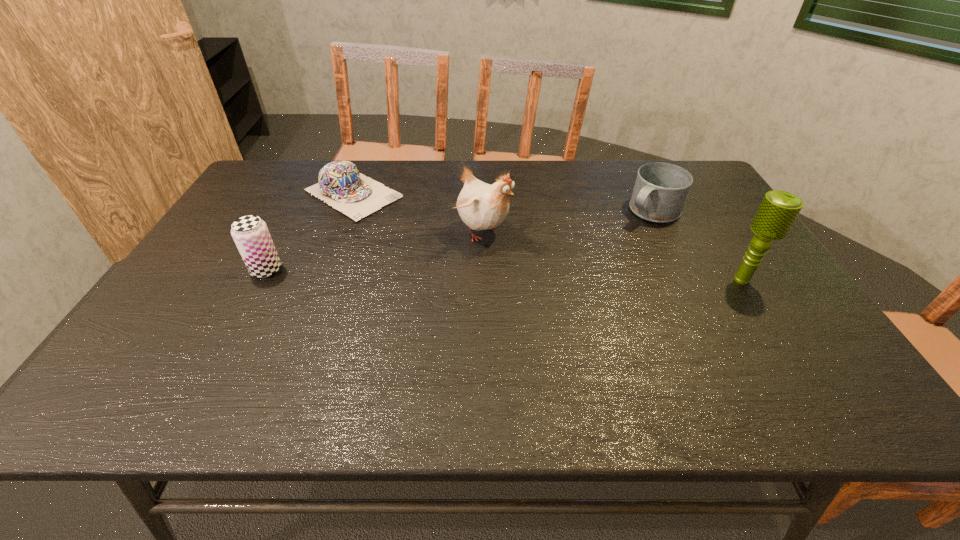
You are a GUI agent. You are given a task and a screenshot of the screen. Output one action in this format:
    pyautogui.click(x=<x>, y=<y>)
    Task: Click on the mug located at the right edge
    
    Given the screenshot: What is the action you would take?
    pyautogui.click(x=660, y=191)

Identify the location of object that is at the far right corner. The height and width of the screenshot is (540, 960). (660, 191).

The width and height of the screenshot is (960, 540). Find the location of `free space at the far edge of the desktop`. free space at the far edge of the desktop is located at coordinates (603, 161).

Find the location of `vacant space at the near edge of the desktop`. vacant space at the near edge of the desktop is located at coordinates (252, 337).

Image resolution: width=960 pixels, height=540 pixels. In the image, there is a desktop. What are the coordinates of `vacant space at the left edge` in the screenshot? It's located at (219, 241).

Where is `vacant space at the right edge`? The image size is (960, 540). vacant space at the right edge is located at coordinates (772, 304).

You are a GUI agent. You are given a task and a screenshot of the screen. Output one action in this format:
    pyautogui.click(x=<x>, y=<y>)
    Task: Click on the vacant space at the far left corner
    The height and width of the screenshot is (540, 960).
    Given the screenshot: What is the action you would take?
    pyautogui.click(x=258, y=172)

This screenshot has width=960, height=540. Identify the location of free location at the far right corner. [674, 164].

Image resolution: width=960 pixels, height=540 pixels. In order to click on free space between the second shortest object and the rightmost object in this screenshot , I will do `click(697, 246)`.

What are the coordinates of `free area in between the beer can and the microphone` in the screenshot? It's located at 504,275.